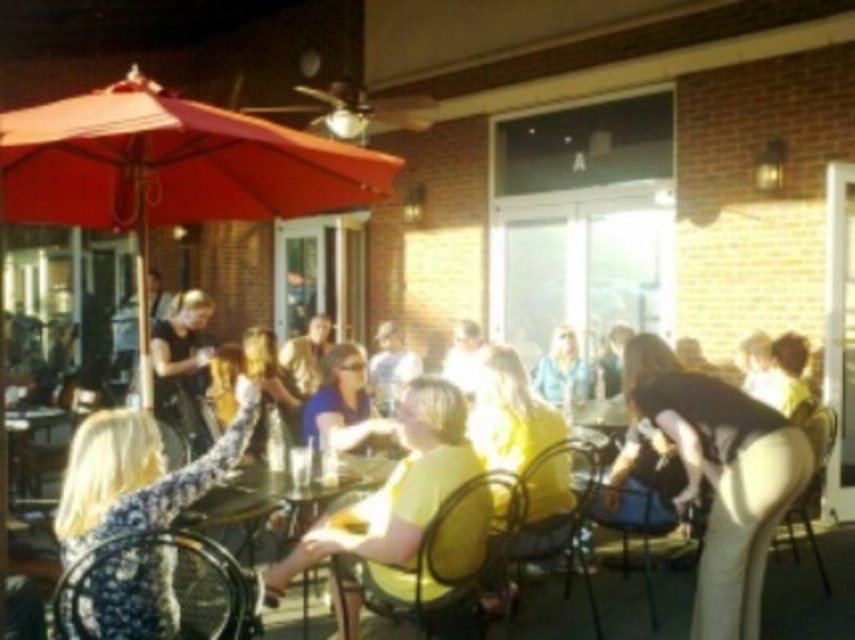
You are a photographer trying to capture a candid shot of the matte black shirt at center without including the floral fabric chair at lower left in the frame. Based on their positions, is this possible?

The floral fabric chair at lower left is below the matte black shirt at center, so it is positioned lower in the scene. This means the photographer can angle the camera upwards to focus on the matte black shirt at center while avoiding the floral fabric chair at lower left in the frame.

You are standing at the entrance of the restaurant and see two points in the image. The first point is at coordinate point (x=57, y=608) and the second is at point (x=195, y=392). If you want to walk towards the point that is closer to the entrance, which coordinate should you head towards?

Point (x=57, y=608) is in front of point (x=195, y=392), so you should head towards point (x=57, y=608) as it is closer to the entrance.

You are a photographer standing at the camera position. You want to capture a photo of the floral fabric chair at lower left without any people in the frame. Given that the camera is 3.13 meters away from the chair, can you adjust your position to avoid including any people in the shot?

The camera is 3.13 meters away from the floral fabric chair at lower left. By moving slightly to the side or adjusting the angle of the camera, you can likely position yourself to capture the chair without including any people in the frame.